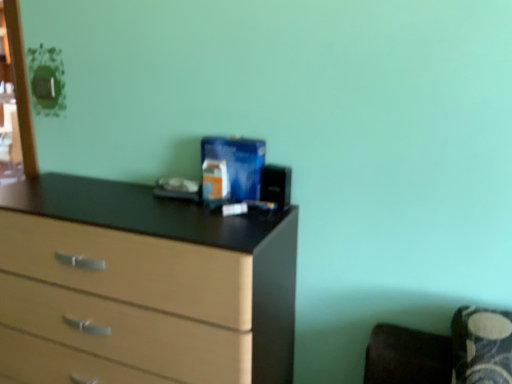
Image resolution: width=512 pixels, height=384 pixels. I want to click on blank space situated above matte wood chest of drawers at left (from a real-world perspective), so click(x=183, y=210).